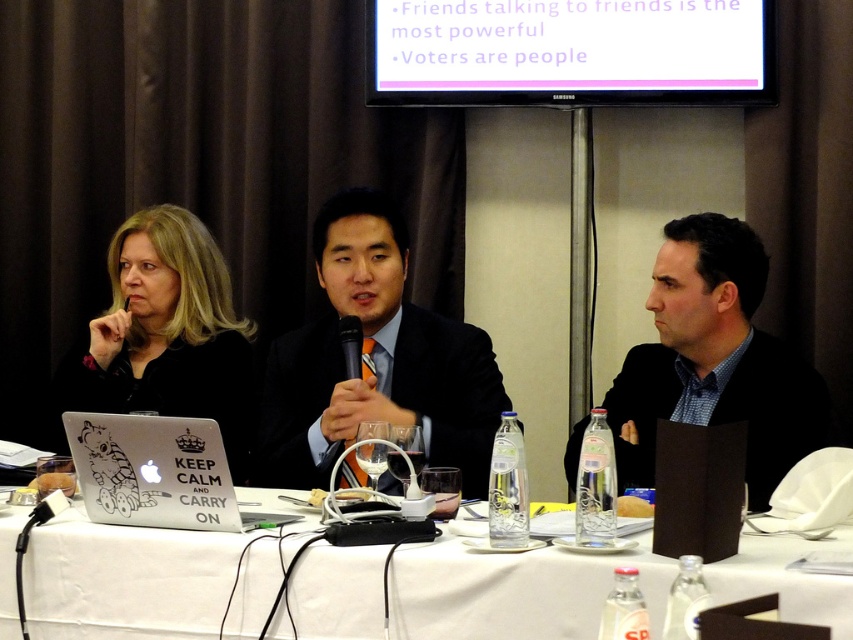
Question: Considering the real-world distances, which object is farthest from the black textured suit at center?

Choices:
 (A) matte black suit at center
 (B) black matte laptop at left

Answer: (B)

Question: Is black textured suit at center wider than white matte laptop at lower left?

Choices:
 (A) yes
 (B) no

Answer: (A)

Question: Among these points, which one is nearest to the camera?

Choices:
 (A) (227, 396)
 (B) (357, 262)

Answer: (B)

Question: Can you confirm if white fabric table at center is bigger than black textured suit at center?

Choices:
 (A) no
 (B) yes

Answer: (B)

Question: Which point is farther to the camera?

Choices:
 (A) black matte laptop at left
 (B) black textured suit at center
 (C) white matte laptop at lower left

Answer: (A)

Question: Does white fabric table at center appear on the right side of black textured suit at center?

Choices:
 (A) yes
 (B) no

Answer: (B)